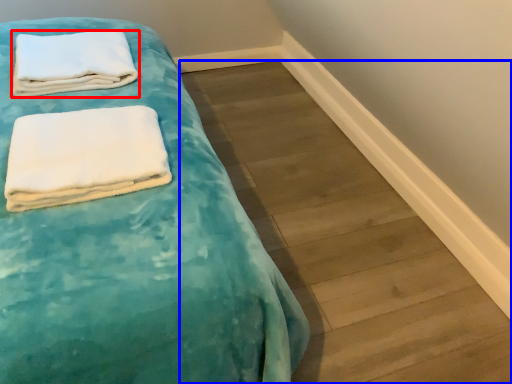
Question: Among these objects, which one is farthest to the camera, towel (highlighted by a red box) or plank (highlighted by a blue box)?

Choices:
 (A) towel
 (B) plank

Answer: (A)